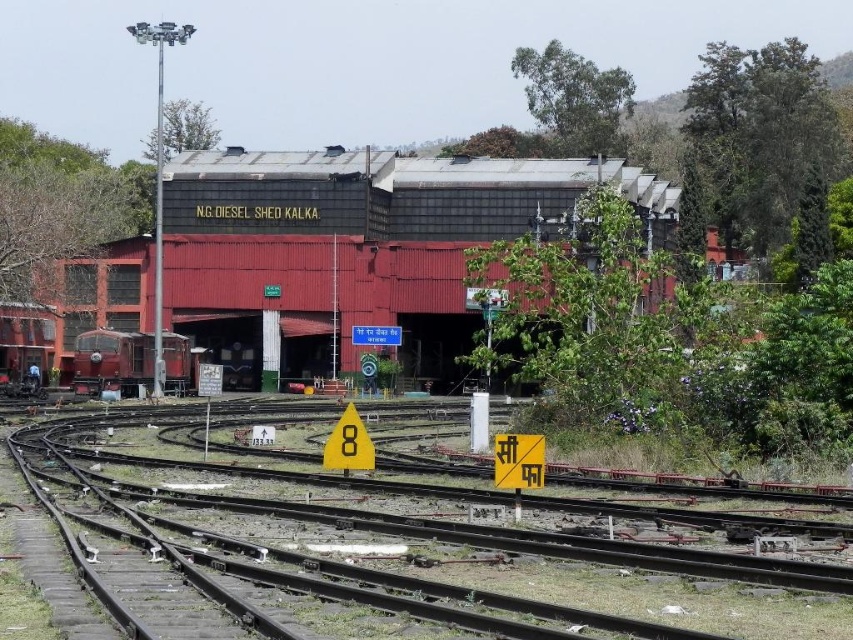
Can you confirm if black metal train track at center is positioned above metallic red train shed at center?

No, black metal train track at center is not above metallic red train shed at center.

Does point (540, 579) come closer to viewer compared to point (65, 365)?

Yes, it is in front of point (65, 365).

You are a GUI agent. You are given a task and a screenshot of the screen. Output one action in this format:
    pyautogui.click(x=<x>, y=<y>)
    Task: Click on the black metal train track at center
    
    Given the screenshot: What is the action you would take?
    pyautogui.click(x=390, y=561)

Who is positioned more to the left, black metal train track at center or matte red train at center?

matte red train at center is more to the left.

Between black metal train track at center and matte red train at center, which one is positioned lower?

black metal train track at center is lower down.

Does point (560, 573) lie behind point (144, 342)?

No.

I want to click on black metal train track at center, so click(390, 561).

Is metallic red train shed at center thinner than matte red train at center?

No.

Can you confirm if metallic red train shed at center is bigger than matte red train at center?

Correct, metallic red train shed at center is larger in size than matte red train at center.

Is point (248, 154) positioned in front of point (115, 364)?

No, it is behind (115, 364).

This screenshot has width=853, height=640. I want to click on metallic red train shed at center, so click(357, 250).